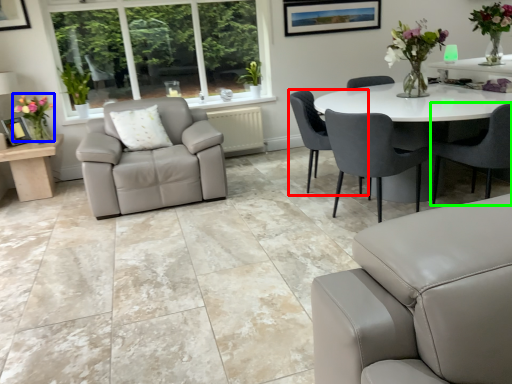
Question: Which object is positioned closest to chair (highlighted by a red box)? Select from floral arrangement (highlighted by a blue box) and chair (highlighted by a green box).

Choices:
 (A) floral arrangement
 (B) chair

Answer: (B)